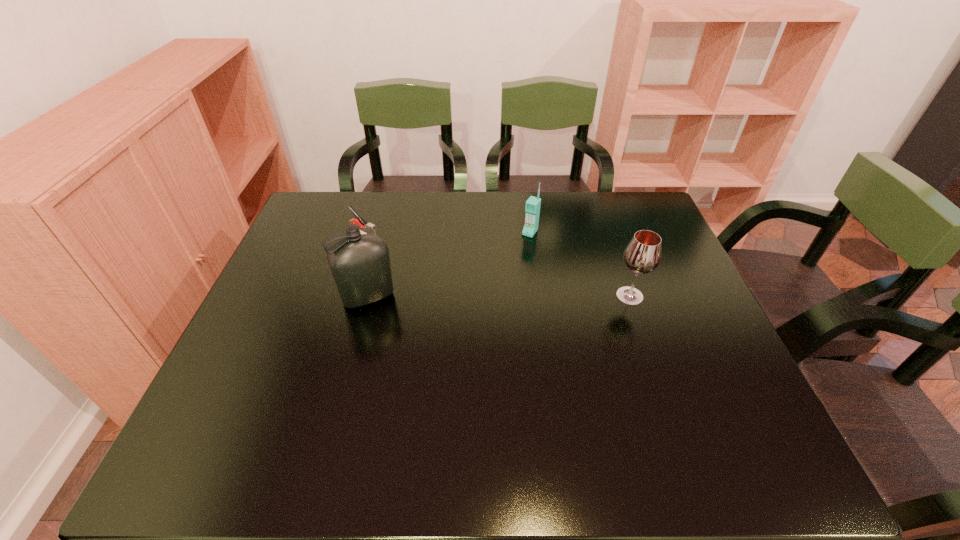
I want to click on vacant space on the desktop that is between the bottle and the rightmost object and is positioned on the keypad of the second object from right to left, so click(483, 296).

I want to click on vacant space on the desktop that is between the tallest object and the wineglass and is positioned on the handle side of the stapler, so click(x=494, y=296).